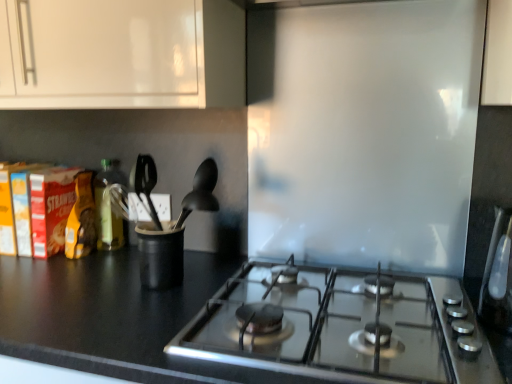
Where is `free spot behind black plastic utensil holder at center`? Image resolution: width=512 pixels, height=384 pixels. free spot behind black plastic utensil holder at center is located at coordinates (195, 258).